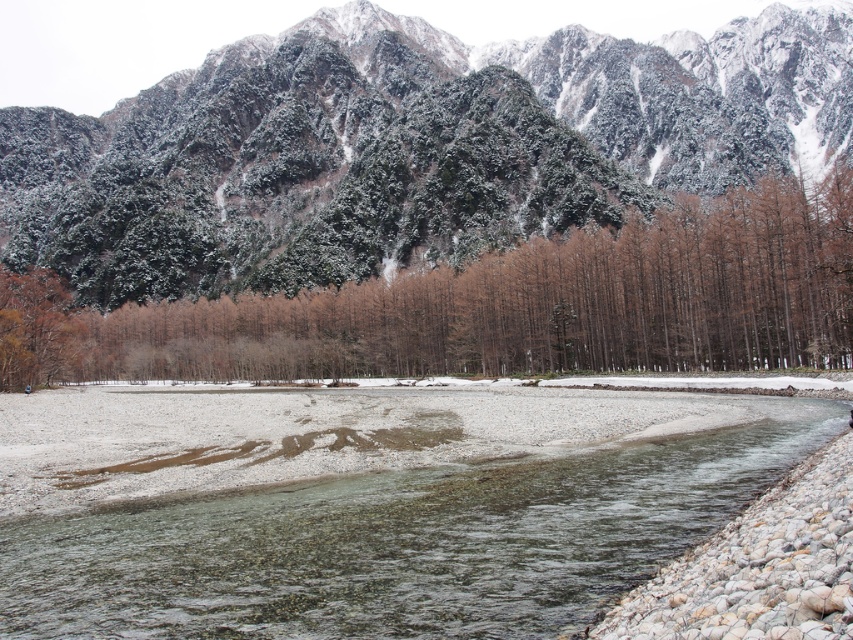
Between point (714, 140) and point (296, 353), which one is positioned in front?

Point (296, 353) is more forward.

Between point (212, 259) and point (526, 369), which one is positioned behind?

Positioned behind is point (212, 259).

Which is in front, point (409, 196) or point (380, 364)?

Point (380, 364) is in front.

Image resolution: width=853 pixels, height=640 pixels. In order to click on green textured mountain at upper center in this screenshot , I will do `click(405, 148)`.

Which is below, green textured mountain at upper center or clear gravel bed at center?

clear gravel bed at center is below.

Where is `green textured mountain at upper center`? This screenshot has height=640, width=853. green textured mountain at upper center is located at coordinates tap(405, 148).

Where is `green textured mountain at upper center`? The width and height of the screenshot is (853, 640). green textured mountain at upper center is located at coordinates (405, 148).

Who is positioned more to the left, clear gravel bed at center or brown matte trees at center?

Positioned to the left is brown matte trees at center.

Where is `clear gravel bed at center`? The height and width of the screenshot is (640, 853). clear gravel bed at center is located at coordinates (398, 540).